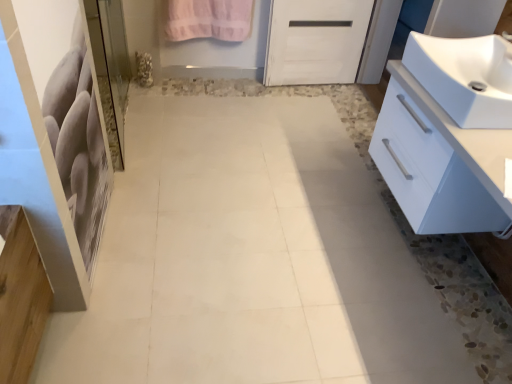
Question: Is white glossy cabinet at right far from pink cotton towel at upper center?

Choices:
 (A) no
 (B) yes

Answer: (B)

Question: From a real-world perspective, is white glossy cabinet at right located higher than pink cotton towel at upper center?

Choices:
 (A) yes
 (B) no

Answer: (A)

Question: Does white glossy cabinet at right appear on the left side of pink cotton towel at upper center?

Choices:
 (A) no
 (B) yes

Answer: (A)

Question: Can you confirm if white glossy cabinet at right is thinner than pink cotton towel at upper center?

Choices:
 (A) yes
 (B) no

Answer: (B)

Question: Considering the relative sizes of white glossy cabinet at right and pink cotton towel at upper center in the image provided, is white glossy cabinet at right taller than pink cotton towel at upper center?

Choices:
 (A) no
 (B) yes

Answer: (B)

Question: Relative to white glossy sink at right, is white glossy cabinet at right in front or behind?

Choices:
 (A) front
 (B) behind

Answer: (A)

Question: Considering the positions of white glossy cabinet at right and white glossy sink at right in the image, is white glossy cabinet at right taller or shorter than white glossy sink at right?

Choices:
 (A) tall
 (B) short

Answer: (A)

Question: From the image's perspective, is white glossy cabinet at right located above or below white glossy sink at right?

Choices:
 (A) above
 (B) below

Answer: (B)

Question: In terms of size, does white glossy cabinet at right appear bigger or smaller than white glossy sink at right?

Choices:
 (A) small
 (B) big

Answer: (B)

Question: Considering the positions of white glossy sink at right and pink cotton towel at upper center in the image, is white glossy sink at right wider or thinner than pink cotton towel at upper center?

Choices:
 (A) wide
 (B) thin

Answer: (A)

Question: In terms of size, does white glossy sink at right appear bigger or smaller than pink cotton towel at upper center?

Choices:
 (A) big
 (B) small

Answer: (A)

Question: From the image's perspective, is white glossy sink at right located above or below pink cotton towel at upper center?

Choices:
 (A) above
 (B) below

Answer: (B)

Question: In terms of height, does white glossy sink at right look taller or shorter compared to pink cotton towel at upper center?

Choices:
 (A) tall
 (B) short

Answer: (B)

Question: From the image's perspective, is white glossy sink at right positioned above or below clear glass screen door at left?

Choices:
 (A) above
 (B) below

Answer: (B)

Question: Considering the positions of white glossy sink at right and clear glass screen door at left in the image, is white glossy sink at right taller or shorter than clear glass screen door at left?

Choices:
 (A) tall
 (B) short

Answer: (B)